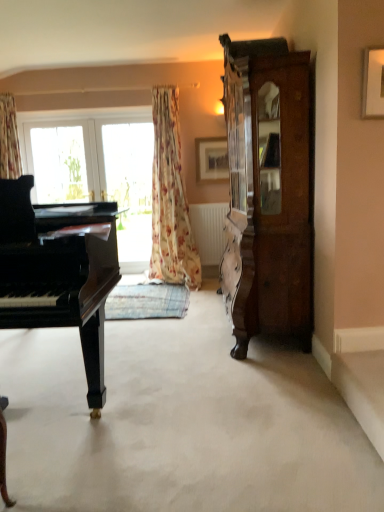
Question: Should I look upward or downward to see black polished piano at left?

Choices:
 (A) down
 (B) up

Answer: (A)

Question: From the image's perspective, is clear glass window at center on top of floral fabric curtain at center?

Choices:
 (A) yes
 (B) no

Answer: (A)

Question: From the image's perspective, does clear glass window at center appear lower than floral fabric curtain at center?

Choices:
 (A) yes
 (B) no

Answer: (B)

Question: Is clear glass window at center taller than floral fabric curtain at center?

Choices:
 (A) no
 (B) yes

Answer: (A)

Question: Does clear glass window at center appear on the left side of floral fabric curtain at center?

Choices:
 (A) yes
 (B) no

Answer: (A)

Question: Can you confirm if clear glass window at center is smaller than floral fabric curtain at center?

Choices:
 (A) no
 (B) yes

Answer: (B)

Question: From a real-world perspective, is clear glass window at center positioned over floral fabric curtain at center based on gravity?

Choices:
 (A) no
 (B) yes

Answer: (A)

Question: Can you confirm if wooden picture frame at upper center, which is the first picture frame in back-to-front order, is thinner than black polished piano at left?

Choices:
 (A) no
 (B) yes

Answer: (B)

Question: From the image's perspective, is wooden picture frame at upper center, which is the 2th picture frame from front to back, over black polished piano at left?

Choices:
 (A) yes
 (B) no

Answer: (A)

Question: Is wooden picture frame at upper center, which is the 1th picture frame in left-to-right order, not inside black polished piano at left?

Choices:
 (A) no
 (B) yes

Answer: (B)

Question: Is wooden picture frame at upper center, which is the 1th picture frame in left-to-right order, not close to black polished piano at left?

Choices:
 (A) yes
 (B) no

Answer: (A)

Question: Does wooden picture frame at upper center, which is the 1th picture frame in left-to-right order, contain black polished piano at left?

Choices:
 (A) no
 (B) yes

Answer: (A)

Question: Can you see wooden picture frame at upper center, placed as the 2th picture frame when sorted from right to left, touching black polished piano at left?

Choices:
 (A) no
 (B) yes

Answer: (A)

Question: Does black polished piano at left appear on the left side of clear glass window at center?

Choices:
 (A) yes
 (B) no

Answer: (A)